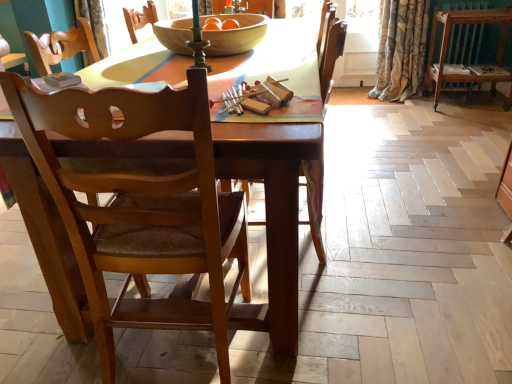
Question: Which direction should I rotate to look at wooden chair at center, which appears as the 2th chair when viewed from the right, — up or down?

Choices:
 (A) down
 (B) up

Answer: (A)

Question: From a real-world perspective, is wooden chair at center, which appears as the 2th chair when viewed from the right, physically above floral velvet curtain at upper right?

Choices:
 (A) yes
 (B) no

Answer: (A)

Question: Considering the relative sizes of wooden chair at center, the first chair in the left-to-right sequence, and floral velvet curtain at upper right in the image provided, is wooden chair at center, the first chair in the left-to-right sequence, taller than floral velvet curtain at upper right?

Choices:
 (A) yes
 (B) no

Answer: (A)

Question: Is wooden chair at center, the first chair in the left-to-right sequence, smaller than floral velvet curtain at upper right?

Choices:
 (A) no
 (B) yes

Answer: (B)

Question: Is wooden chair at center, the first chair in the left-to-right sequence, outside floral velvet curtain at upper right?

Choices:
 (A) no
 (B) yes

Answer: (B)

Question: Does wooden chair at center, the first chair in the left-to-right sequence, have a greater width compared to floral velvet curtain at upper right?

Choices:
 (A) no
 (B) yes

Answer: (A)

Question: From the image's perspective, is wooden chair at center, the first chair in the left-to-right sequence, on floral velvet curtain at upper right?

Choices:
 (A) no
 (B) yes

Answer: (A)

Question: Is wooden chair at center, which appears as the 2th chair when viewed from the right, thinner than wooden chair at center, which is counted as the 2th chair, starting from the left?

Choices:
 (A) no
 (B) yes

Answer: (A)

Question: Is wooden chair at center, the first chair in the left-to-right sequence, behind wooden chair at center, which is counted as the 2th chair, starting from the left?

Choices:
 (A) yes
 (B) no

Answer: (B)

Question: Considering the relative positions of wooden chair at center, the first chair in the left-to-right sequence, and wooden chair at center, the first chair from the right, in the image provided, is wooden chair at center, the first chair in the left-to-right sequence, to the right of wooden chair at center, the first chair from the right, from the viewer's perspective?

Choices:
 (A) no
 (B) yes

Answer: (A)

Question: Does wooden chair at center, which appears as the 2th chair when viewed from the right, have a greater height compared to wooden chair at center, which is counted as the 2th chair, starting from the left?

Choices:
 (A) yes
 (B) no

Answer: (A)

Question: From a real-world perspective, does wooden chair at center, the first chair in the left-to-right sequence, stand above wooden chair at center, which is counted as the 2th chair, starting from the left?

Choices:
 (A) no
 (B) yes

Answer: (B)

Question: Is wooden chair at center, which appears as the 2th chair when viewed from the right, bigger than wooden chair at center, which is counted as the 2th chair, starting from the left?

Choices:
 (A) yes
 (B) no

Answer: (A)

Question: Is wooden bowl at center shorter than brown wooden radiator at upper right?

Choices:
 (A) no
 (B) yes

Answer: (B)